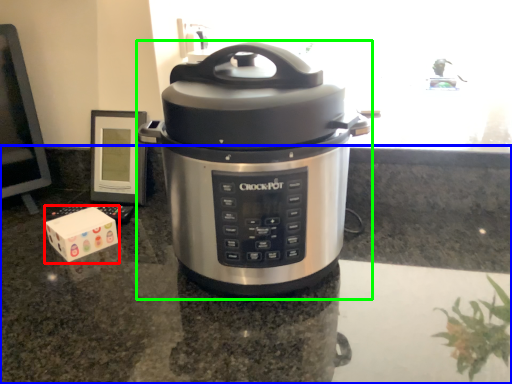
Question: Estimate the real-world distances between objects in this image. Which object is closer to block (highlighted by a red box), counter top (highlighted by a blue box) or slow cooker (highlighted by a green box)?

Choices:
 (A) counter top
 (B) slow cooker

Answer: (A)